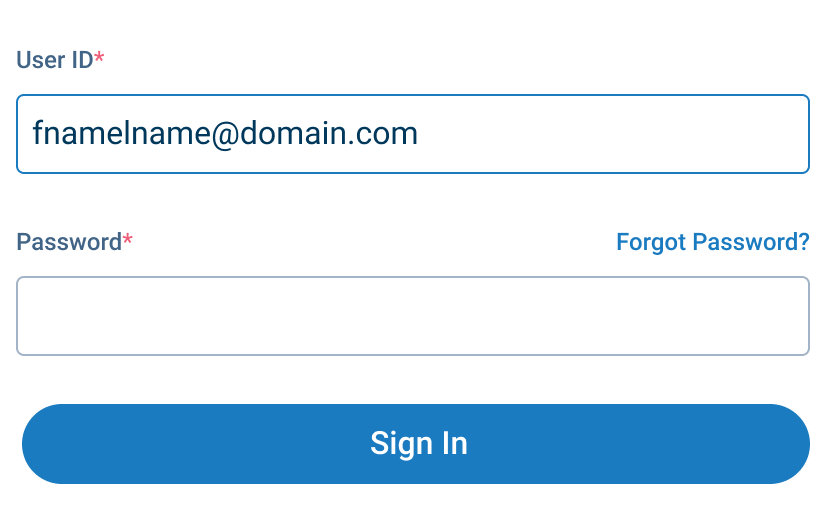
What are the coordinates of `empty box` in the screenshot? It's located at (111, 321).